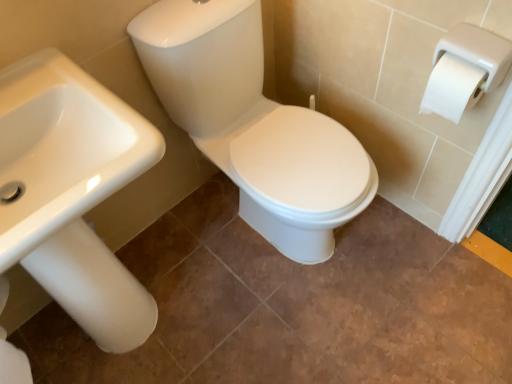
Locate an element on the screen. The width and height of the screenshot is (512, 384). free space in front of white glossy toilet seat at center is located at coordinates (307, 330).